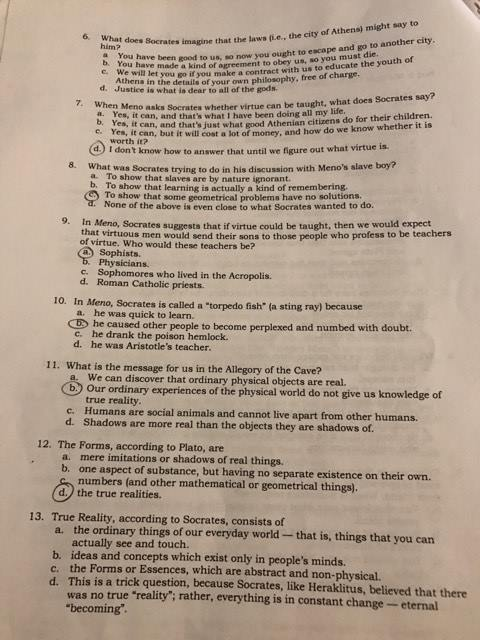
Identify the location of document. The width and height of the screenshot is (480, 640). (297, 502).